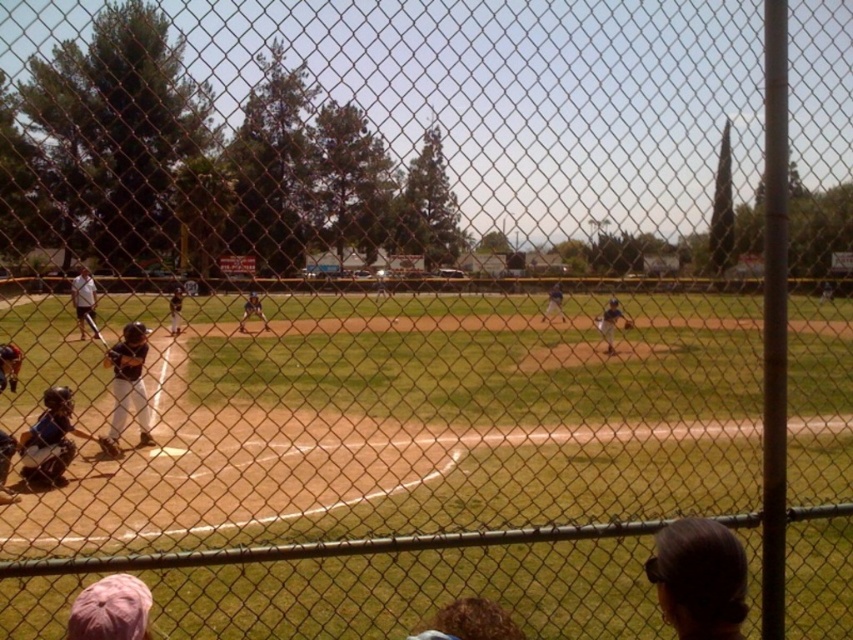
Question: Which of these objects is positioned closest to the blue uniform at center?

Choices:
 (A) blue matte catcher at lower left
 (B) matte blue baseball glove at center
 (C) brown leather glove at center

Answer: (C)

Question: Which point is closer to the camera?

Choices:
 (A) (254, 307)
 (B) (624, 323)

Answer: (B)

Question: Is orange helmet at lower left further to camera compared to brown leather glove at center?

Choices:
 (A) no
 (B) yes

Answer: (A)

Question: Does matte black bat at center have a smaller size compared to matte black baseball bat at left?

Choices:
 (A) yes
 (B) no

Answer: (A)

Question: Which is farther from the matte black baseball glove at center?

Choices:
 (A) brown leather glove at center
 (B) blue matte catcher at lower left
 (C) blue uniform at center
 (D) white uniform at center

Answer: (B)

Question: Does matte black baseball bat at left have a greater width compared to matte black baseball glove at center?

Choices:
 (A) yes
 (B) no

Answer: (A)